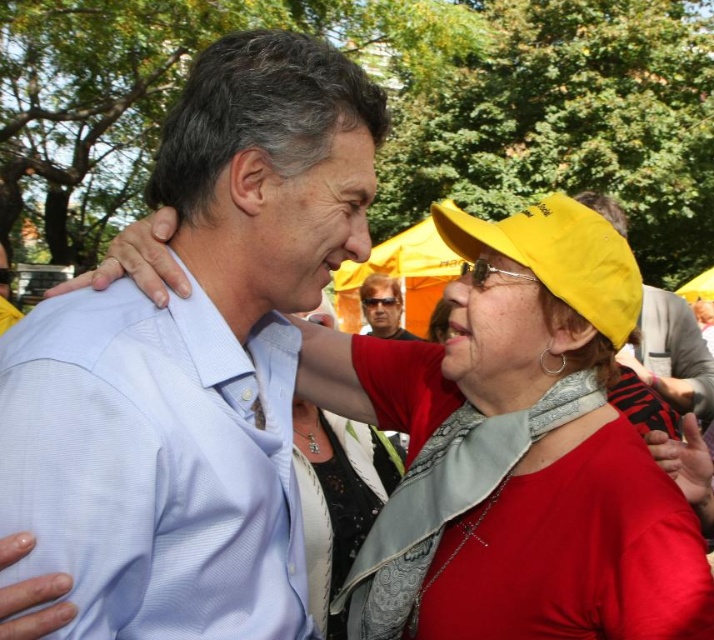
In the scene shown: Is light blue shirt at center wider than matte black sunglasses at center?

Correct, the width of light blue shirt at center exceeds that of matte black sunglasses at center.

Does light blue shirt at center appear under matte black sunglasses at center?

Correct, light blue shirt at center is located below matte black sunglasses at center.

Does point (246, 452) come closer to viewer compared to point (391, 301)?

Yes, point (246, 452) is closer to viewer.

I want to click on light blue shirt at center, so click(196, 362).

Does matte yellow hat at upper right appear under matte black sunglasses at center?

Yes.

Which is below, matte yellow hat at upper right or matte black sunglasses at center?

matte yellow hat at upper right is below.

Which is in front, point (678, 316) or point (392, 280)?

Point (678, 316)

What are the coordinates of `matte yellow hat at upper right` in the screenshot? It's located at (670, 353).

Is point (164, 436) closer to viewer compared to point (638, 326)?

Yes, it is.

Is light blue shirt at center positioned in front of matte yellow hat at upper right?

Yes, light blue shirt at center is closer to the viewer.

Where is `light blue shirt at center`? light blue shirt at center is located at coordinates (196, 362).